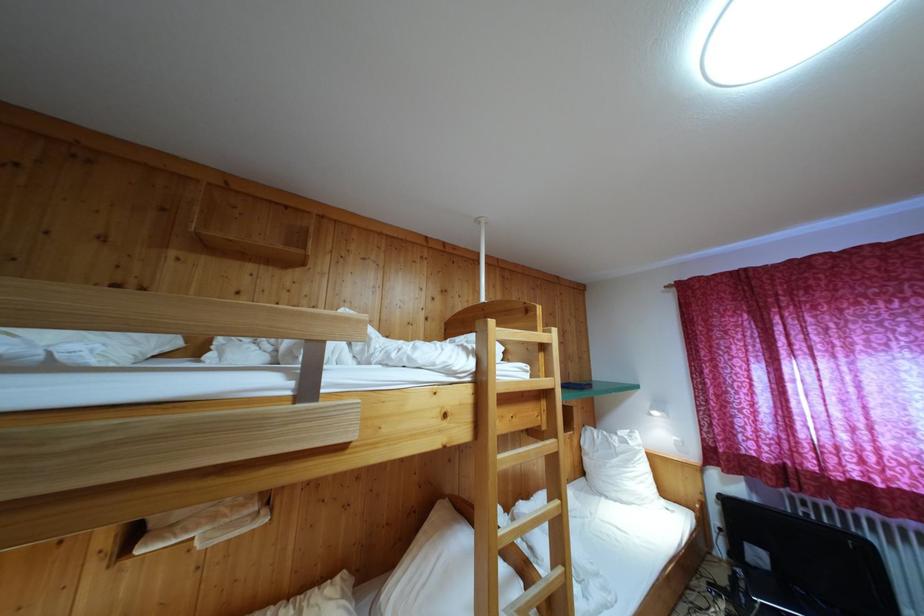
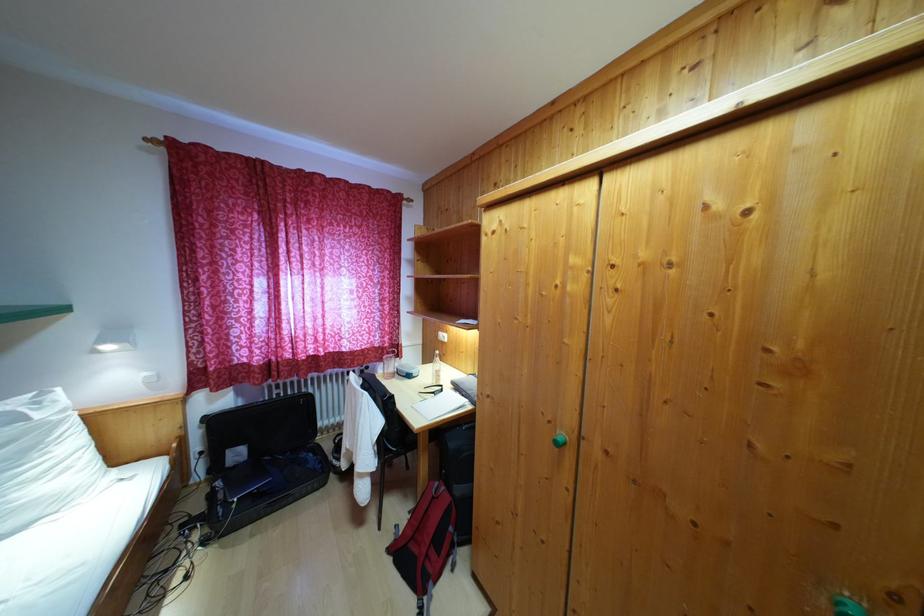
Question: Based on the continuous images, in which direction is the camera rotating? Reply with the corresponding letter.

Choices:
 (A) Left
 (B) Right
 (C) Up
 (D) Down

Answer: (B)